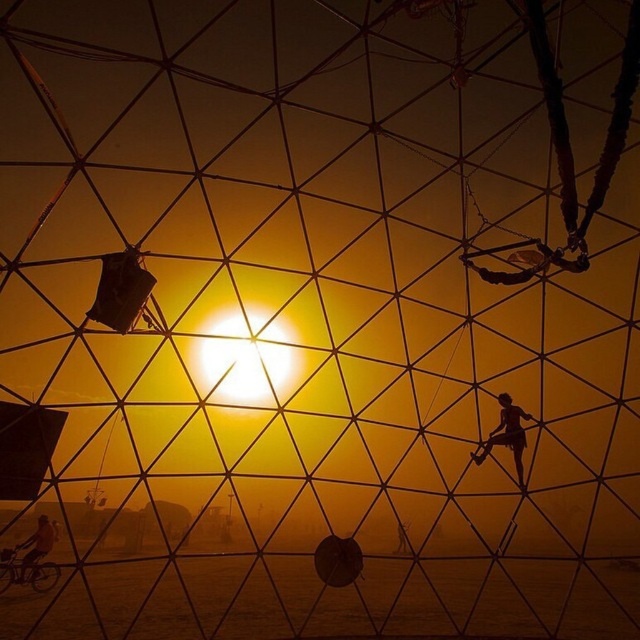
You are standing in front of the geodesic dome and want to determine the relative positions of two points marked on its surface. The points are labeled as point (515, 470) and point (44, 541). Based on your observation, which point is closer to you?

Point (515, 470) is closer to you because it is further to the viewer compared to point (44, 541).

Based on the coordinates provided in the Objects Description, where is the matte black figure at center located in the image?

The matte black figure at center is located at point coordinates of (506, 435).

You are standing at the camera position and want to take a photo of the matte black figure at center. If your camera has a focal length of 50mm and you want to ensure the figure fills the frame, what adjustment should you make to your distance?

The matte black figure at center is 50.55 feet away from the camera. To fill the frame, you should move closer to the figure since the current distance may be too far for a 50mm lens to capture the figure at the desired size.